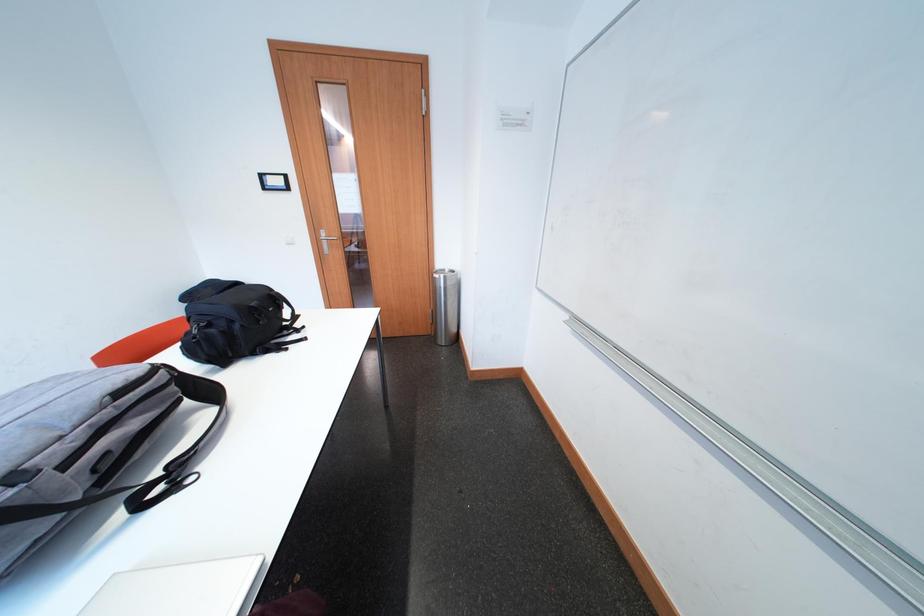
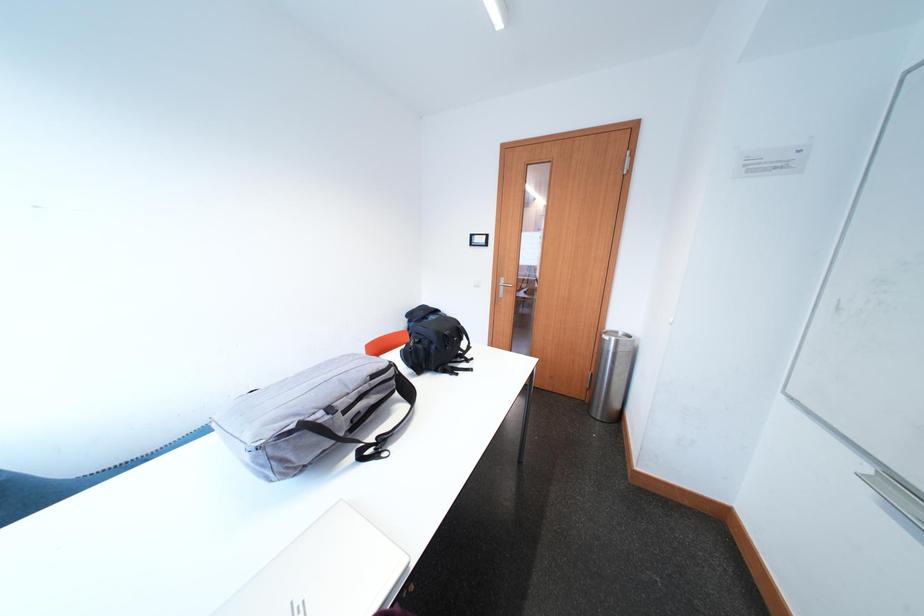
Question: The first image is from the beginning of the video and the second image is from the end. How did the camera likely rotate when shooting the video?

Choices:
 (A) Left
 (B) Right
 (C) Up
 (D) Down

Answer: (A)